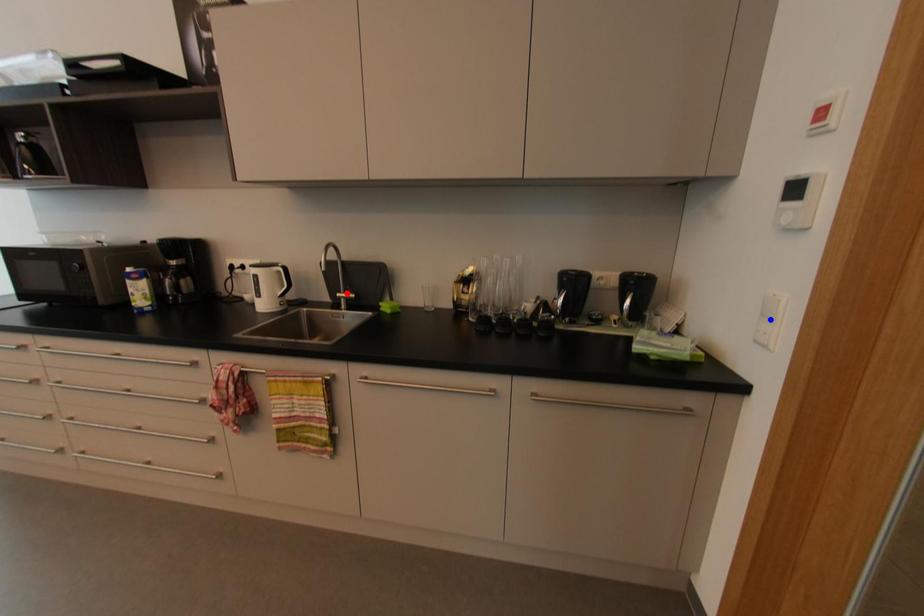
Question: Two points are marked on the image. Which point is closer to the camera?

Choices:
 (A) Blue point is closer.
 (B) Red point is closer.

Answer: (A)